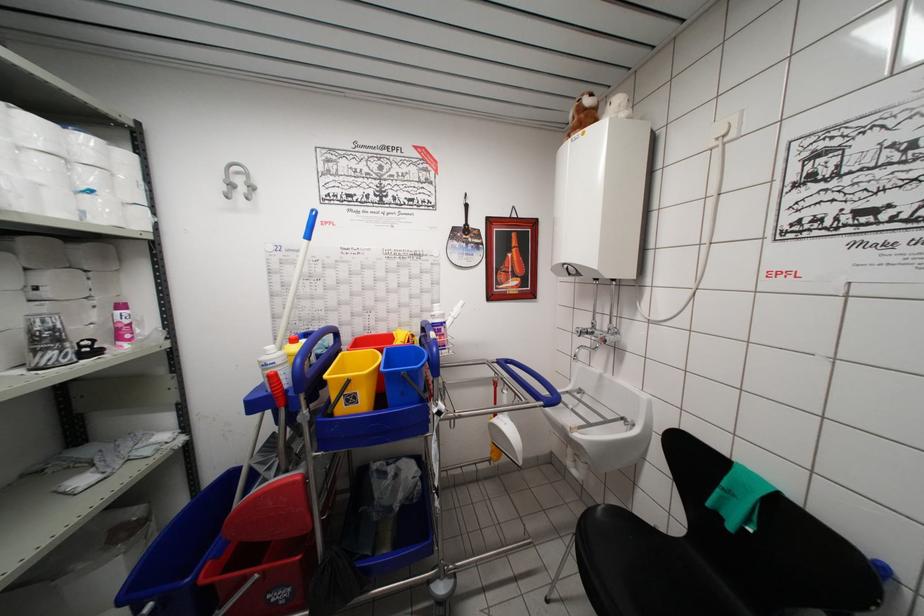
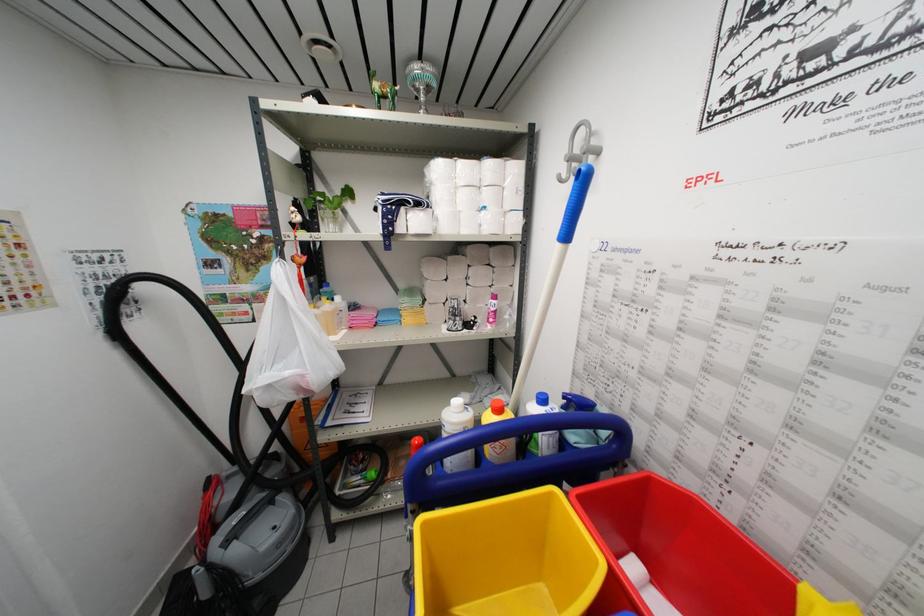
The point at (92, 182) is marked in the first image. Where is the corresponding point in the second image?

(490, 201)